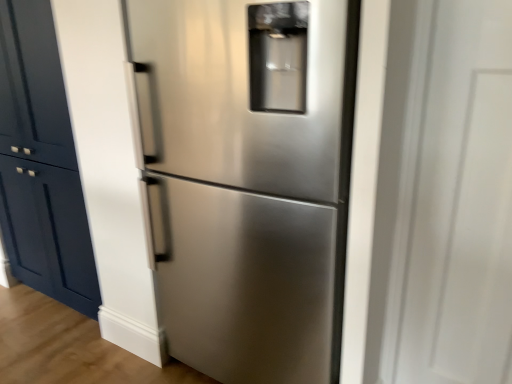
Question: From a real-world perspective, is matte navy blue cabinet at left beneath stainless steel refrigerator at center?

Choices:
 (A) no
 (B) yes

Answer: (A)

Question: Can you confirm if matte navy blue cabinet at left is bigger than stainless steel refrigerator at center?

Choices:
 (A) no
 (B) yes

Answer: (A)

Question: Is matte navy blue cabinet at left shorter than stainless steel refrigerator at center?

Choices:
 (A) yes
 (B) no

Answer: (B)

Question: Does matte navy blue cabinet at left contain stainless steel refrigerator at center?

Choices:
 (A) no
 (B) yes

Answer: (A)

Question: From the image's perspective, is matte navy blue cabinet at left under stainless steel refrigerator at center?

Choices:
 (A) yes
 (B) no

Answer: (B)

Question: Is matte navy blue cabinet at left completely or partially outside of stainless steel refrigerator at center?

Choices:
 (A) no
 (B) yes

Answer: (B)

Question: Does stainless steel refrigerator at center have a greater width compared to transparent glass door at right?

Choices:
 (A) no
 (B) yes

Answer: (B)

Question: Does stainless steel refrigerator at center appear on the right side of transparent glass door at right?

Choices:
 (A) yes
 (B) no

Answer: (B)

Question: Is stainless steel refrigerator at center behind transparent glass door at right?

Choices:
 (A) yes
 (B) no

Answer: (A)

Question: From a real-world perspective, is stainless steel refrigerator at center physically below transparent glass door at right?

Choices:
 (A) yes
 (B) no

Answer: (A)

Question: Is stainless steel refrigerator at center positioned beyond the bounds of transparent glass door at right?

Choices:
 (A) no
 (B) yes

Answer: (B)

Question: Can you confirm if stainless steel refrigerator at center is bigger than transparent glass door at right?

Choices:
 (A) yes
 (B) no

Answer: (A)

Question: Is matte navy blue cabinet at left at the back of transparent glass door at right?

Choices:
 (A) no
 (B) yes

Answer: (A)